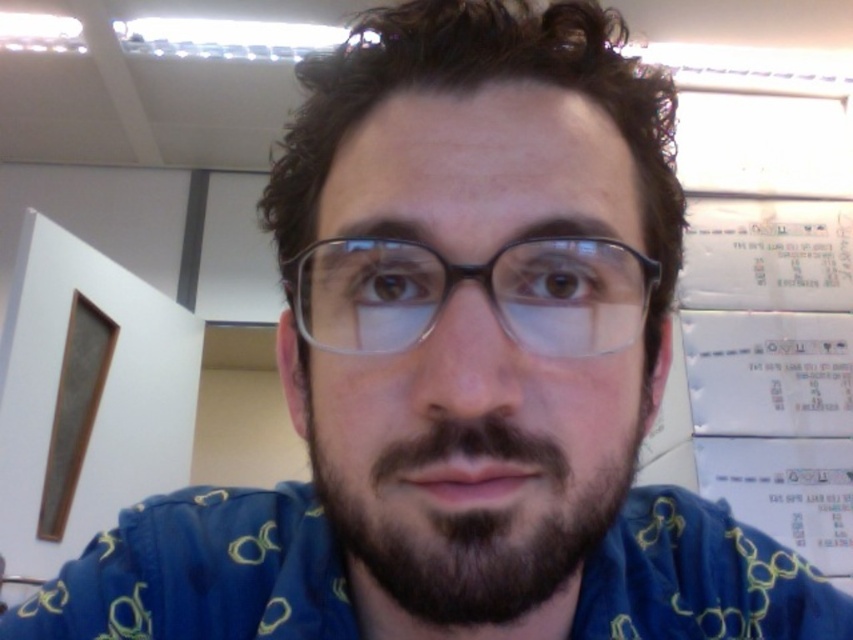
Between point (438, 566) and point (335, 305), which one is positioned in front?

Point (438, 566) is in front.

Who is positioned more to the left, dark brown fuzzy beard at center or transparent plastic glasses at center?

From the viewer's perspective, transparent plastic glasses at center appears more on the left side.

Image resolution: width=853 pixels, height=640 pixels. Describe the element at coordinates (474, 520) in the screenshot. I see `dark brown fuzzy beard at center` at that location.

Find the location of a particular element. The width and height of the screenshot is (853, 640). dark brown fuzzy beard at center is located at coordinates (474, 520).

Is point (701, 481) farther from viewer compared to point (345, 541)?

Yes, it is behind point (345, 541).

At what (x,y) coordinates should I click in order to perform the action: click on white paper at upper right. Please return your answer as a coordinate pair (x, y). Image resolution: width=853 pixels, height=640 pixels. Looking at the image, I should click on (764, 371).

Identify the location of white paper at upper right. This screenshot has height=640, width=853. (764, 371).

Between white paper at upper right and transparent plastic glasses at center, which one appears on the left side from the viewer's perspective?

transparent plastic glasses at center is more to the left.

The height and width of the screenshot is (640, 853). What do you see at coordinates (764, 371) in the screenshot?
I see `white paper at upper right` at bounding box center [764, 371].

Locate an element on the screen. The image size is (853, 640). white paper at upper right is located at coordinates (764, 371).

The image size is (853, 640). In order to click on white paper at upper right in this screenshot , I will do `click(764, 371)`.